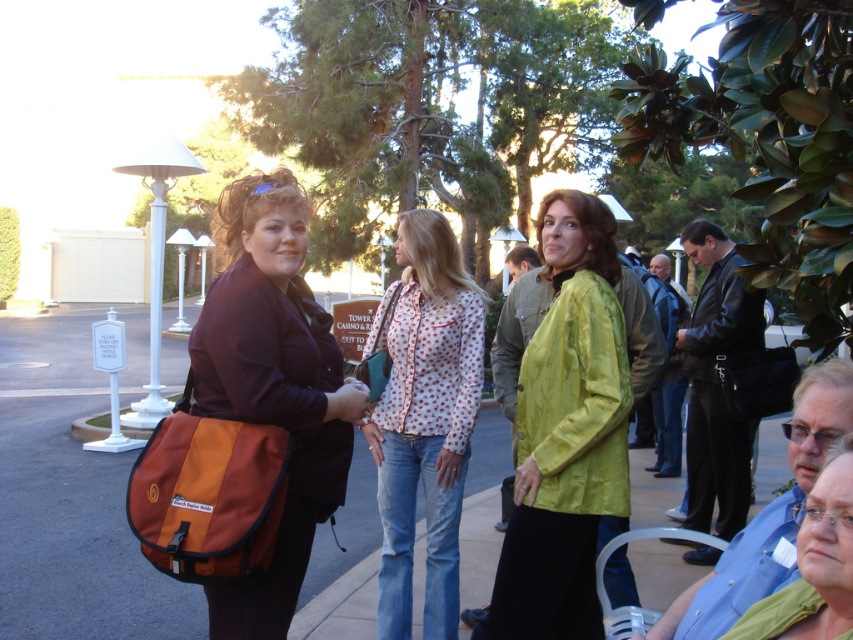
You are a photographer standing in the scene and want to take a photo of both the matte brown bag at center and the green matte jacket at lower right. Which object should you position to the left side in your camera frame?

The matte brown bag at center should be positioned to the left side in your camera frame because it is already on the left side of the green matte jacket at lower right.

You are a photographer trying to capture a photo of the green matte jacket at lower right without the matte brown bag at center blocking the view. Can you adjust your position to do so?

The matte brown bag at center is located above the green matte jacket at lower right, so if you move your camera angle downward, you can avoid the bag and capture the jacket without obstruction.

You are a delivery person who needs to place a package on the ground. The package is as wide as the matte brown bag at center. There is a space next to the green matte jacket at lower right. Do you think the package will fit in that space?

The matte brown bag at center is wider than the green matte jacket at lower right. Since the package is as wide as the matte brown bag at center, it will not fit in the space next to the green matte jacket at lower right.